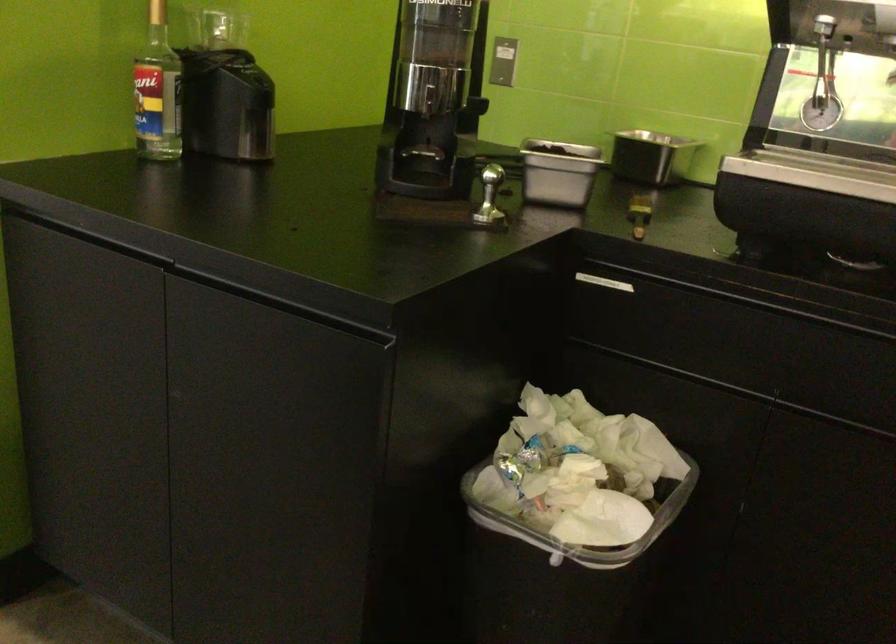
The height and width of the screenshot is (644, 896). What do you see at coordinates (823, 82) in the screenshot? I see `the espresso machine lever` at bounding box center [823, 82].